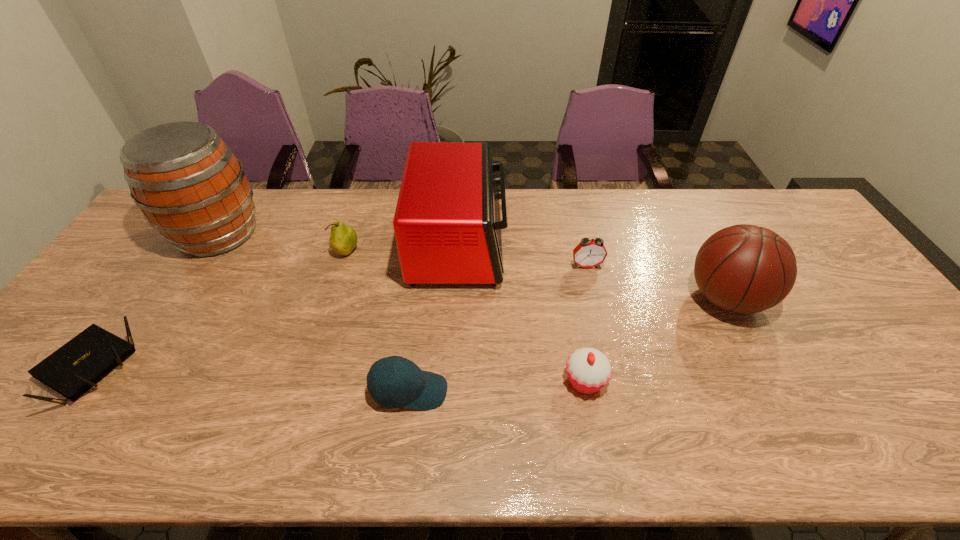
Image resolution: width=960 pixels, height=540 pixels. I want to click on cider, so click(x=190, y=187).

At what (x,y) coordinates should I click in order to perform the action: click on toaster oven. Please return your answer as a coordinate pair (x, y). Looking at the image, I should click on (447, 223).

Image resolution: width=960 pixels, height=540 pixels. I want to click on the rightmost object, so pos(745,269).

Locate an element on the screen. pear is located at coordinates (343, 239).

Find the location of a particular element. alarm clock is located at coordinates (588, 253).

This screenshot has height=540, width=960. Identify the location of cupcake. (589, 370).

You are a GUI agent. You are given a task and a screenshot of the screen. Output one action in this format:
    pyautogui.click(x=<x>, y=<y>)
    Task: Click on the baseball cap
    
    Given the screenshot: What is the action you would take?
    pyautogui.click(x=393, y=382)

What are the coordinates of `vacant region located on the front of the tallest object` in the screenshot? It's located at (134, 366).

I want to click on free space located on the front-facing side of the toaster oven, so click(536, 244).

Where is `vacant space situated on the back of the rightmost object`? This screenshot has width=960, height=540. vacant space situated on the back of the rightmost object is located at coordinates (689, 226).